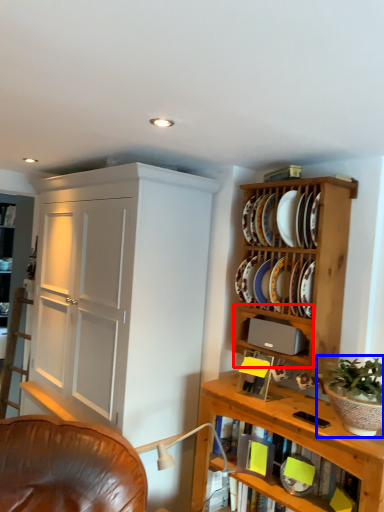
Question: Which of the following is the closest to the observer, cabinet (highlighted by a red box) or houseplant (highlighted by a blue box)?

Choices:
 (A) cabinet
 (B) houseplant

Answer: (B)